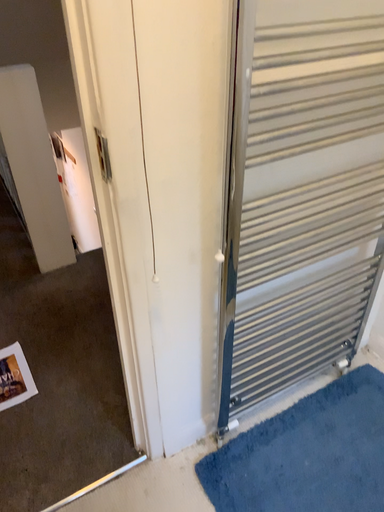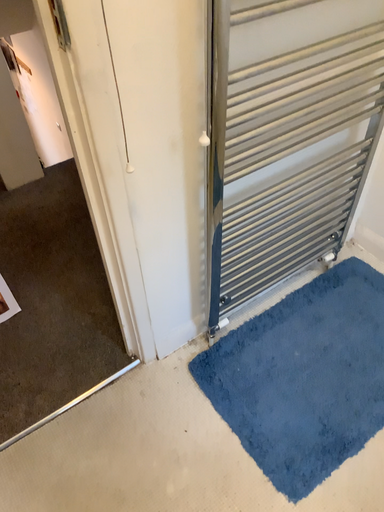
Question: How did the camera likely rotate when shooting the video?

Choices:
 (A) rotated downward
 (B) rotated upward

Answer: (A)